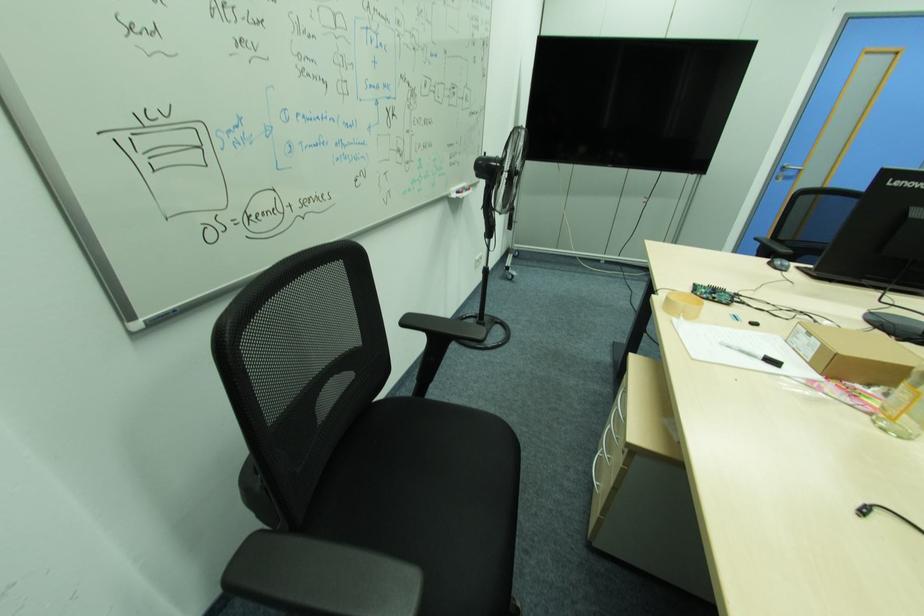
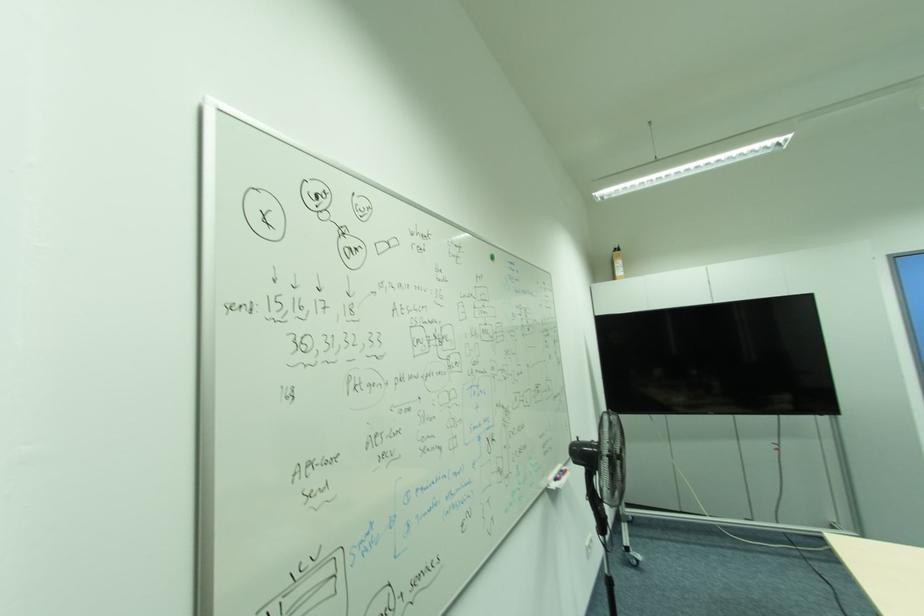
Locate, in the second image, the point that corresponds to point (463, 193) in the first image.

(561, 479)